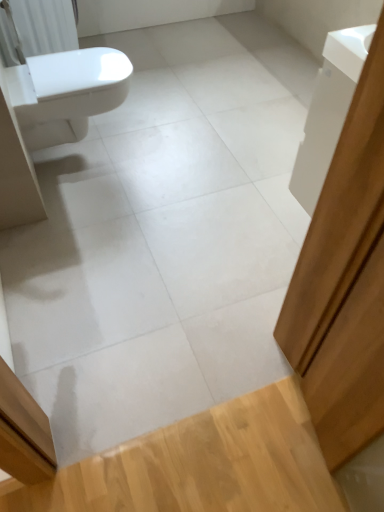
Question: Based on their positions, is white glossy cabinet at upper right located to the left or right of white glossy bidet at left?

Choices:
 (A) left
 (B) right

Answer: (B)

Question: Based on their sizes in the image, would you say white glossy cabinet at upper right is bigger or smaller than white glossy bidet at left?

Choices:
 (A) small
 (B) big

Answer: (A)

Question: Which object is positioned closest to the white glossy bidet at left?

Choices:
 (A) white glossy cabinet at upper right
 (B) white plastic radiator at upper left
 (C) light wood floor at lower right

Answer: (B)

Question: Estimate the real-world distances between objects in this image. Which object is farther from the white glossy cabinet at upper right?

Choices:
 (A) white plastic radiator at upper left
 (B) white glossy bidet at left
 (C) light wood floor at lower right

Answer: (A)